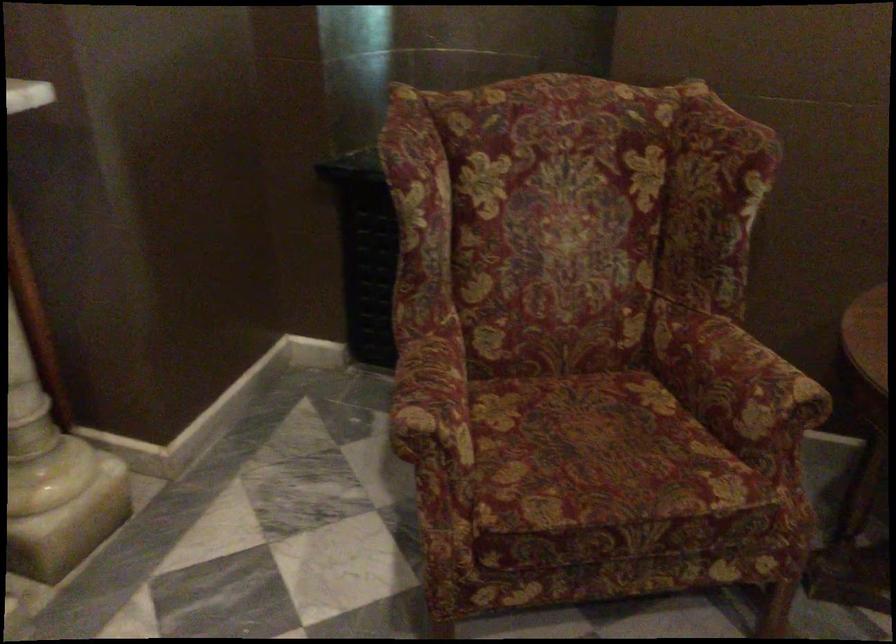
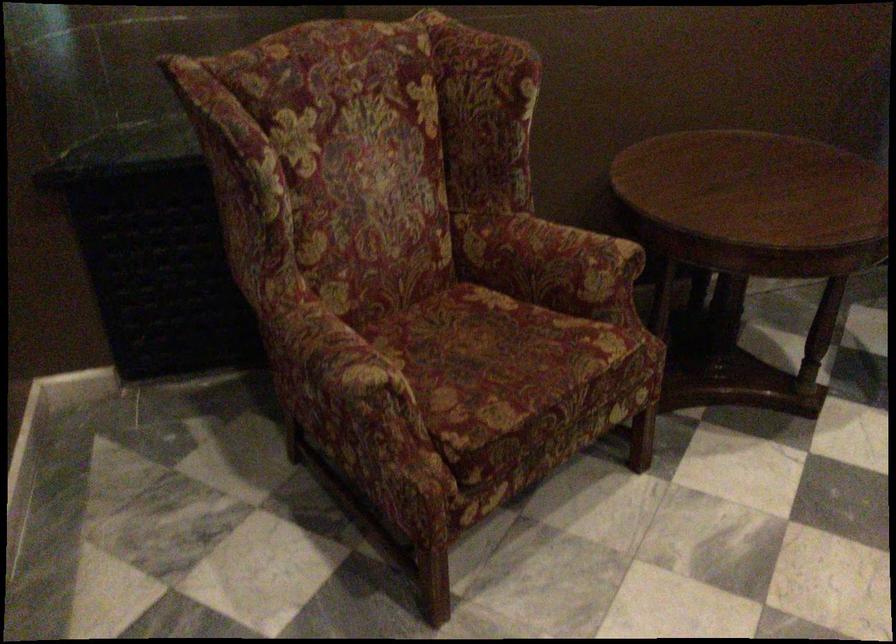
Locate, in the second image, the point that corresponds to [741,379] in the first image.

(572, 256)